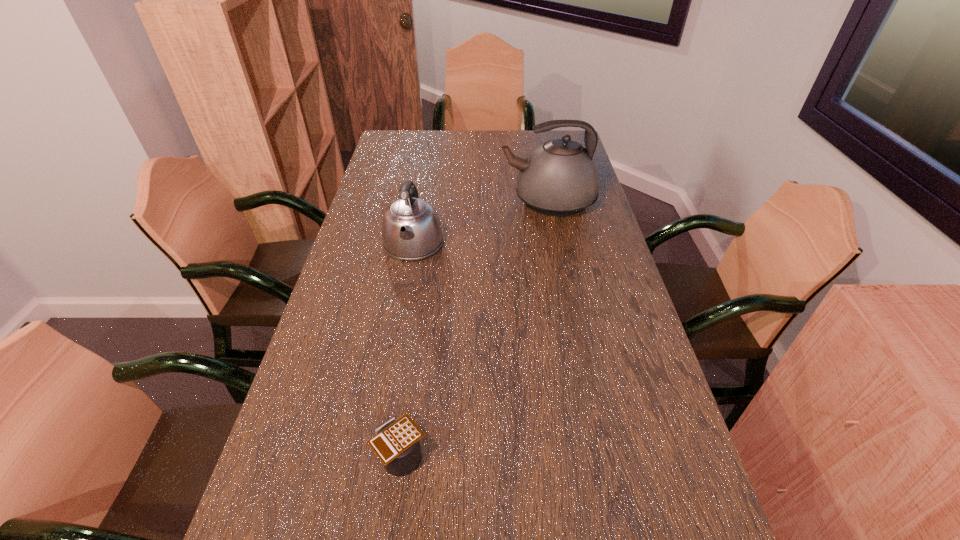
Find the location of a particular element. object that stands as the closest to the second tallest object is located at coordinates (559, 178).

The image size is (960, 540). In order to click on the second closest object relative to the shorter kettle in this screenshot , I will do `click(396, 443)`.

Identify the location of free space that satisfies the following two spatial constraints: 1. on the spout of the nearest object; 2. on the left side of the shorter kettle. The image size is (960, 540). (375, 456).

What are the coordinates of `free space that satisfies the following two spatial constraints: 1. at the spout of the rightmost object; 2. on the spout of the shorter kettle` in the screenshot? It's located at (557, 244).

Where is `free location that satisfies the following two spatial constraints: 1. at the spout of the rightmost object; 2. on the spout of the second tallest object`? free location that satisfies the following two spatial constraints: 1. at the spout of the rightmost object; 2. on the spout of the second tallest object is located at coordinates (557, 244).

I want to click on free location that satisfies the following two spatial constraints: 1. at the spout of the taller kettle; 2. on the spout of the shorter kettle, so click(557, 244).